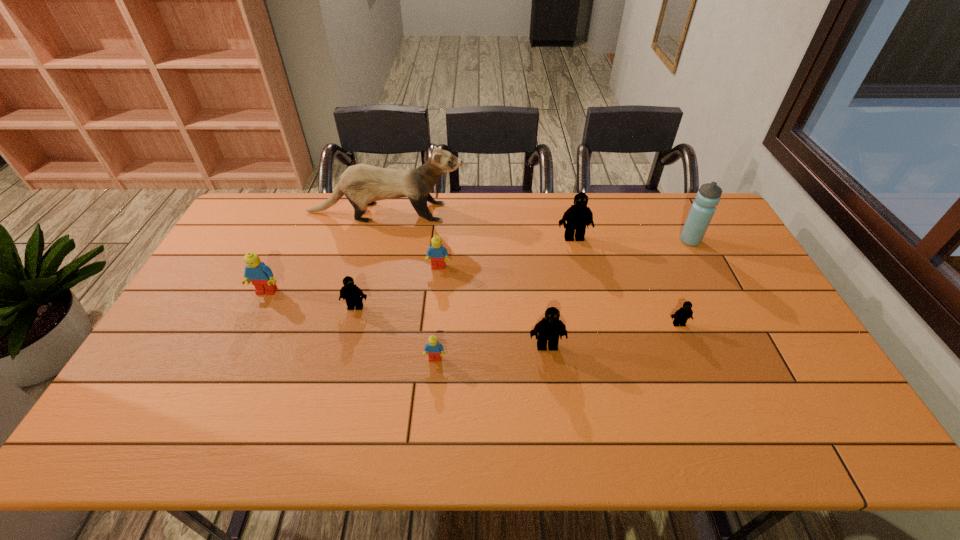
Image resolution: width=960 pixels, height=540 pixels. Find the location of `free location that satisfies the following two spatial constraints: 1. on the face of the ferret; 2. on the left side of the water bottle`. free location that satisfies the following two spatial constraints: 1. on the face of the ferret; 2. on the left side of the water bottle is located at coordinates (378, 240).

What are the coordinates of `vacant space that satisfies the following two spatial constraints: 1. on the face of the gray ferret; 2. on the face of the third biggest black Lego` in the screenshot? It's located at (362, 307).

Find the location of a particular element. This screenshot has width=960, height=540. free space that satisfies the following two spatial constraints: 1. on the face of the ferret; 2. on the face of the second nearest blue Lego is located at coordinates (366, 292).